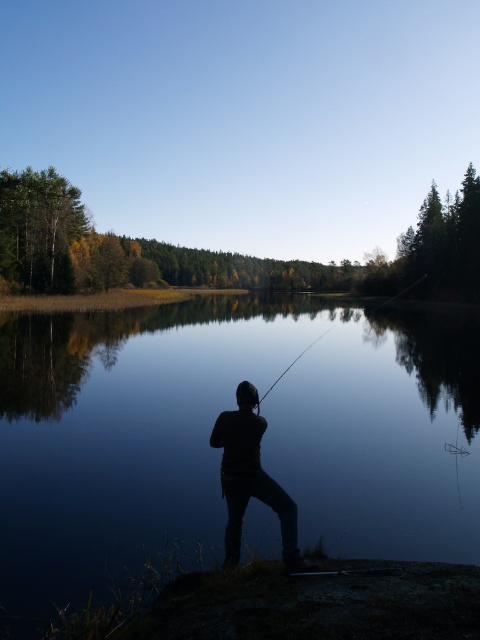
Question: Which of these objects is positioned farthest from the smooth black rod at center?

Choices:
 (A) black matte person at center
 (B) transparent water at center

Answer: (A)

Question: Can you confirm if black matte person at center is wider than smooth black rod at center?

Choices:
 (A) no
 (B) yes

Answer: (A)

Question: Is transparent water at center to the left of black matte person at center from the viewer's perspective?

Choices:
 (A) no
 (B) yes

Answer: (B)

Question: Which point is farther to the camera?

Choices:
 (A) (248, 436)
 (B) (310, 314)

Answer: (B)

Question: Which point is closer to the camera?

Choices:
 (A) (294, 364)
 (B) (92, 554)

Answer: (B)

Question: Is black matte person at center above smooth black rod at center?

Choices:
 (A) yes
 (B) no

Answer: (A)